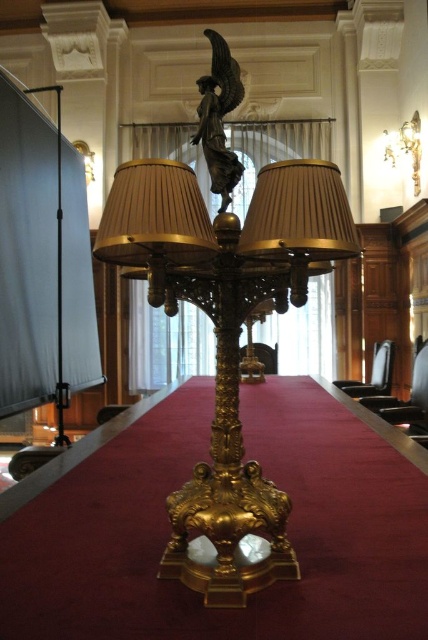
Who is more distant from viewer, (371, 608) or (412, 125)?

The point (412, 125) is behind.

Measure the distance between gold/gilded table at center and gold metallic lampshade at upper right.

gold/gilded table at center and gold metallic lampshade at upper right are 12.76 feet apart.

Does point (38, 634) lie in front of point (403, 141)?

That is True.

At what (x,y) coordinates should I click in order to perform the action: click on gold/gilded table at center. Please return your answer as a coordinate pair (x, y). The height and width of the screenshot is (640, 428). Looking at the image, I should click on (169, 529).

Is point (219, 150) closer to camera compared to point (416, 147)?

Yes, it is.

Looking at this image, is bronze statue at center bigger than gold metallic lampshade at upper right?

Actually, bronze statue at center might be smaller than gold metallic lampshade at upper right.

Does point (235, 80) come closer to viewer compared to point (418, 148)?

Yes, point (235, 80) is in front of point (418, 148).

Locate an element on the screen. The height and width of the screenshot is (640, 428). bronze statue at center is located at coordinates (219, 116).

Can you confirm if gold/gilded table at center is shorter than bronze statue at center?

Correct, gold/gilded table at center is not as tall as bronze statue at center.

Which of these two, gold/gilded table at center or bronze statue at center, stands taller?

bronze statue at center

What do you see at coordinates (169, 529) in the screenshot? I see `gold/gilded table at center` at bounding box center [169, 529].

Find the location of a particular element. gold/gilded table at center is located at coordinates (169, 529).